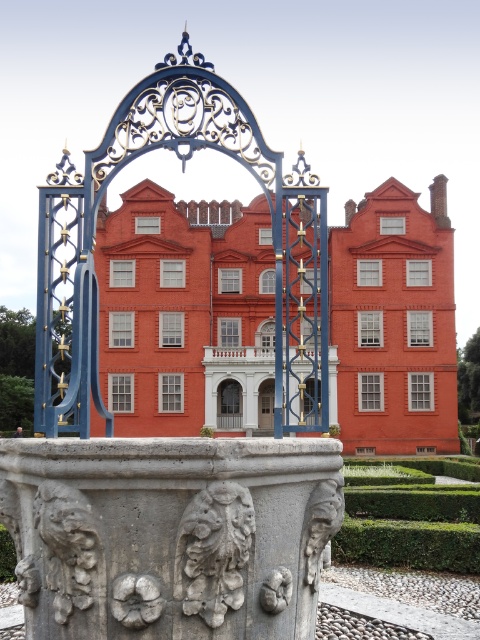
Does gray stone pillar at center appear under matte glass door at center?

No.

Who is more distant from viewer, (45, 452) or (228, 428)?

The point (228, 428) is more distant.

Who is more distant from viewer, (60, 616) or (228, 422)?

Point (228, 422)

Identify the location of gray stone pillar at center. The image size is (480, 640). (169, 534).

Does smooth brick palace at center appear under white stone carving at center?

No.

The image size is (480, 640). In order to click on smooth brick palace at center in this screenshot , I will do `click(183, 310)`.

Is point (179, 280) closer to viewer compared to point (223, 589)?

No, (179, 280) is further to viewer.

Find the location of a particular element. smooth brick palace at center is located at coordinates (183, 310).

Is green leafy hedge at lower right shorter than matte glass door at center?

Correct, green leafy hedge at lower right is not as tall as matte glass door at center.

Is green leafy hedge at lower right positioned before matte glass door at center?

Yes, it is.

Who is more distant from viewer, (443, 504) or (240, 410)?

The point (240, 410) is behind.

Locate an element on the screen. The height and width of the screenshot is (640, 480). green leafy hedge at lower right is located at coordinates (411, 518).